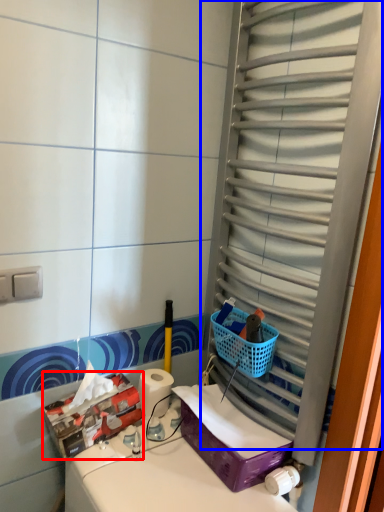
Question: Which object appears farthest to the camera in this image, storage box (highlighted by a red box) or glass door (highlighted by a blue box)?

Choices:
 (A) storage box
 (B) glass door

Answer: (A)